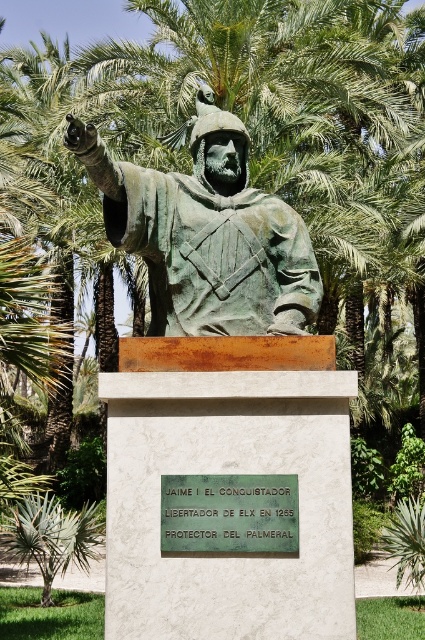
Does bronze statue at center have a greater width compared to green leafy palm tree at lower left?

Incorrect, bronze statue at center's width does not surpass green leafy palm tree at lower left's.

Looking at this image, who is more forward, (249,330) or (25,532)?

Point (249,330) is more forward.

Where is `bronze statue at center`? The width and height of the screenshot is (425, 640). bronze statue at center is located at coordinates (206, 234).